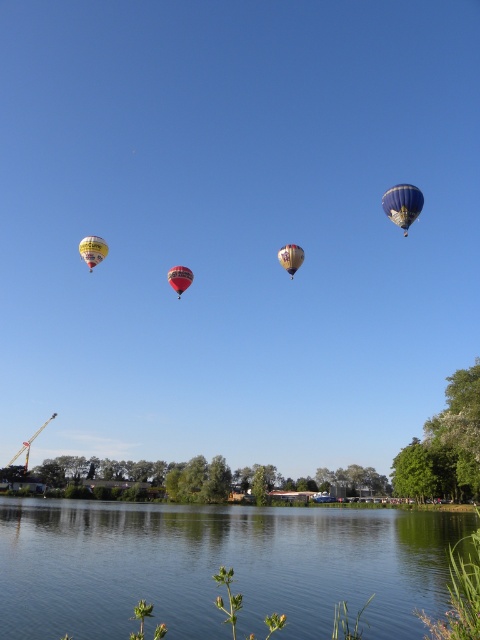
Can you confirm if multicolored fabric balloon at center is positioned above red glossy hot air balloon at center?

Yes.

Is multicolored fabric balloon at center bigger than red glossy hot air balloon at center?

No, multicolored fabric balloon at center is not bigger than red glossy hot air balloon at center.

Which is behind, point (300, 262) or point (170, 268)?

Point (170, 268)

The width and height of the screenshot is (480, 640). What are the coordinates of `multicolored fabric balloon at center` in the screenshot? It's located at (290, 257).

Between blue glossy hot air balloon at upper right and multicolored fabric balloon at center, which one is positioned higher?

multicolored fabric balloon at center is higher up.

Does point (402, 195) come closer to viewer compared to point (298, 266)?

Yes, it is in front of point (298, 266).

Identify the location of blue glossy hot air balloon at upper right. (403, 204).

Which of these two, green smooth water at lower center or multicolored fabric balloon at center, stands taller?

green smooth water at lower center

Does green smooth water at lower center appear under multicolored fabric balloon at center?

Correct, green smooth water at lower center is located below multicolored fabric balloon at center.

Locate an element on the screen. green smooth water at lower center is located at coordinates (217, 566).